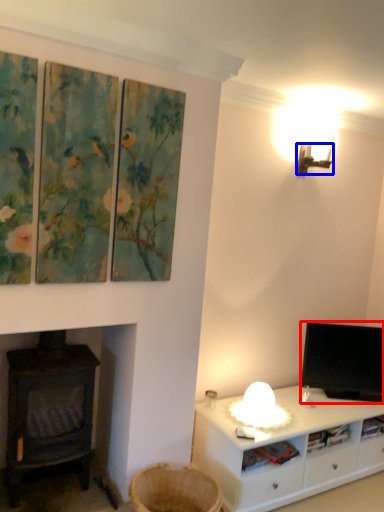
Question: Which object appears farthest to the camera in this image, television (highlighted by a red box) or lamp (highlighted by a blue box)?

Choices:
 (A) television
 (B) lamp

Answer: (A)